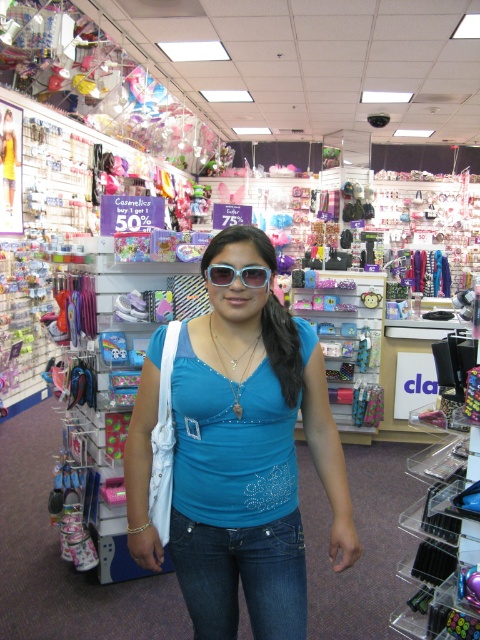
Can you confirm if translucent plastic sunglasses at center is positioned below gold metallic necklace at center?

No, translucent plastic sunglasses at center is not below gold metallic necklace at center.

Is the position of translucent plastic sunglasses at center less distant than that of gold metallic necklace at center?

That is True.

Between point (227, 275) and point (247, 358), which one is positioned behind?

Point (247, 358)

Find the location of a particular element. The image size is (480, 640). translucent plastic sunglasses at center is located at coordinates point(238,275).

Is point (136, 435) positioned after point (260, 284)?

Yes, it is.

Is matte blue blouse at center smaller than translucent plastic sunglasses at center?

Actually, matte blue blouse at center might be larger than translucent plastic sunglasses at center.

Between point (235, 323) and point (219, 269), which one is positioned behind?

The point (235, 323) is more distant.

Where is `matte blue blouse at center`? The width and height of the screenshot is (480, 640). matte blue blouse at center is located at coordinates (249, 452).

The image size is (480, 640). What do you see at coordinates (249, 452) in the screenshot?
I see `matte blue blouse at center` at bounding box center [249, 452].

The image size is (480, 640). What do you see at coordinates (249, 452) in the screenshot?
I see `matte blue blouse at center` at bounding box center [249, 452].

Image resolution: width=480 pixels, height=640 pixels. I want to click on matte blue blouse at center, so click(x=249, y=452).